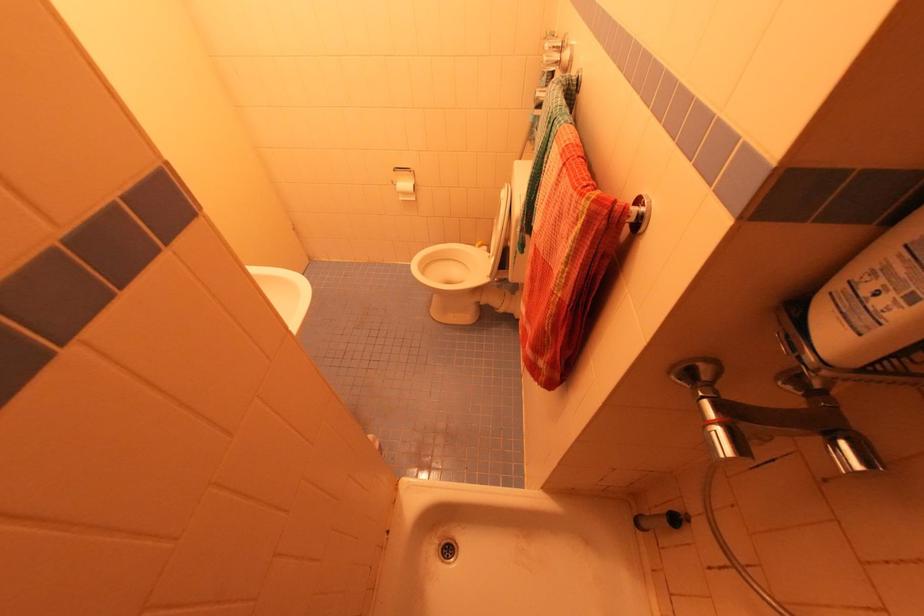
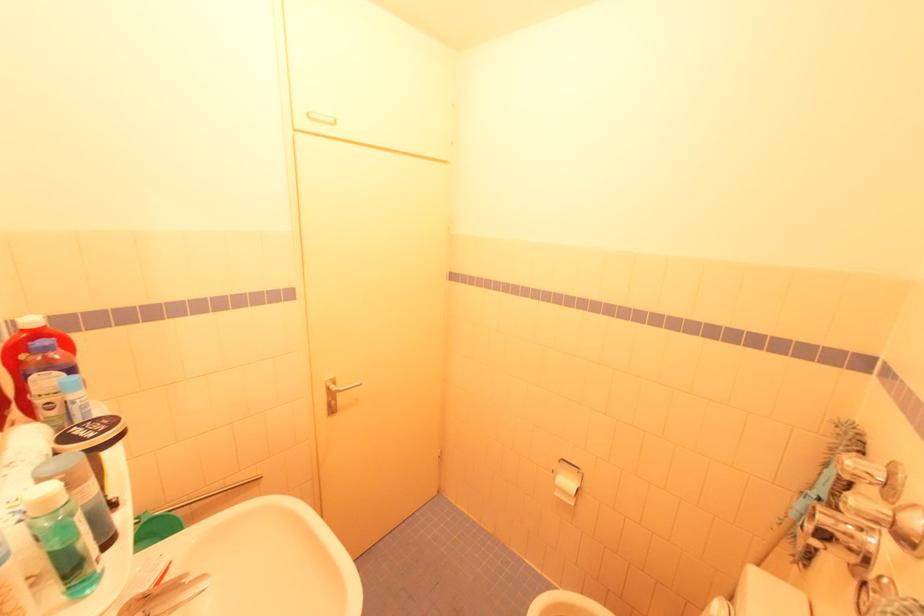
First-person continuous shooting, in which direction is the camera rotating?

The rotation direction of the camera is left-up.